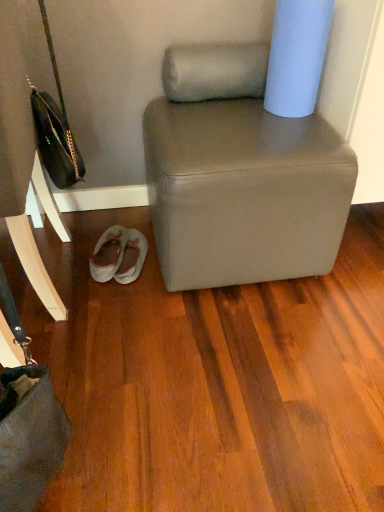
At what (x,y) coordinates should I click in order to perform the action: click on vacant area that lies between leather handbag at left and light gray suede slippers at lower left. Please return your answer as a coordinate pair (x, y). Looking at the image, I should click on (107, 286).